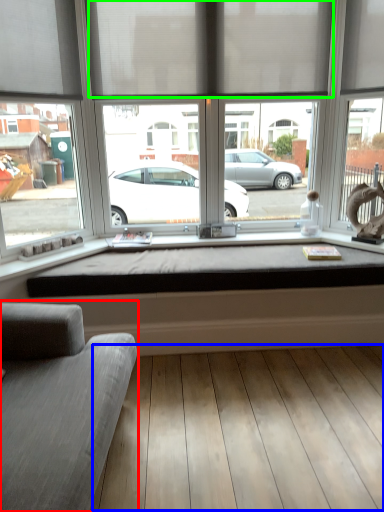
Question: Which object is positioned closest to studio couch (highlighted by a red box)? Select from plank (highlighted by a blue box) and curtain (highlighted by a green box).

Choices:
 (A) plank
 (B) curtain

Answer: (A)